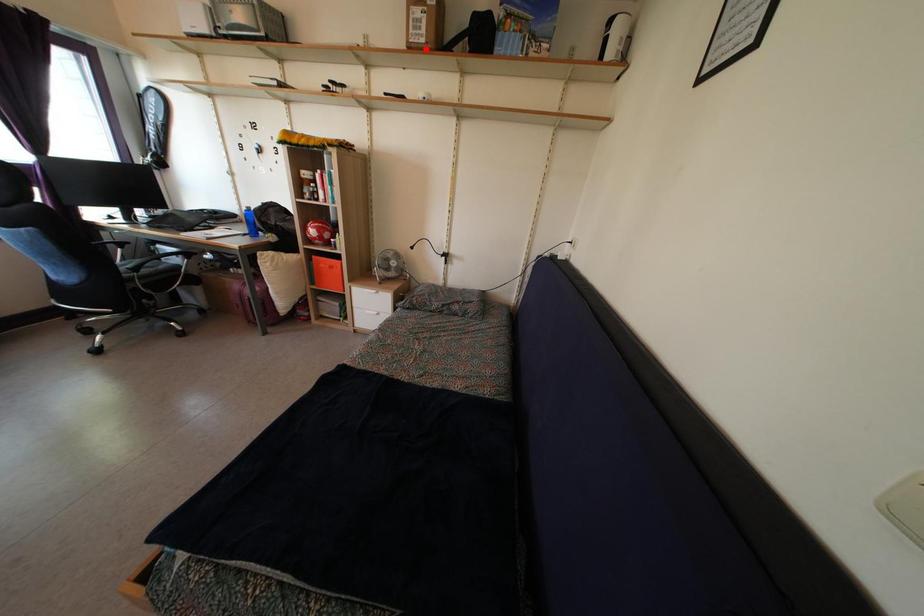
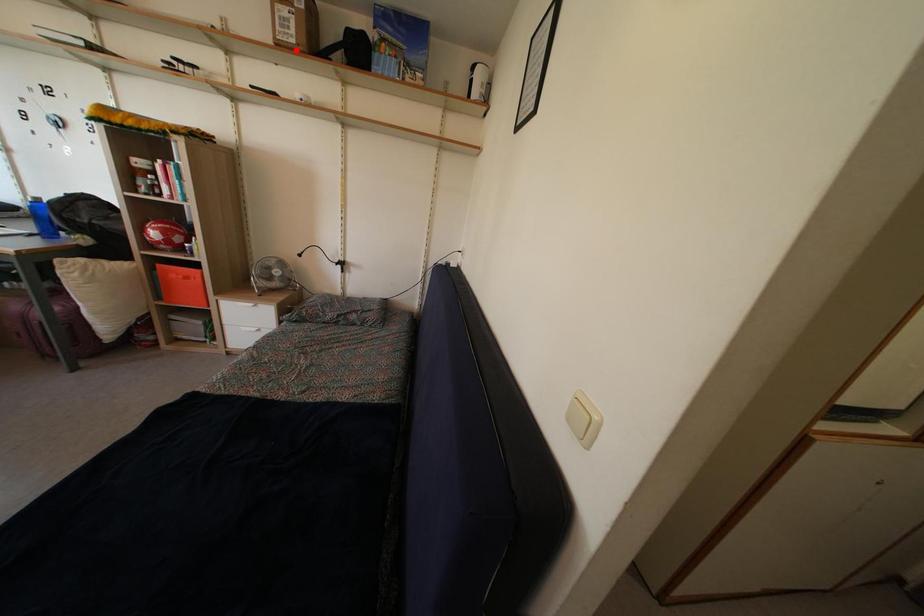
I am providing you with two images of the same scene from different viewpoints. A red point is marked on the first image and another point is marked on the second image. Is the red point in image1 aligned with the point shown in image2?

Yes